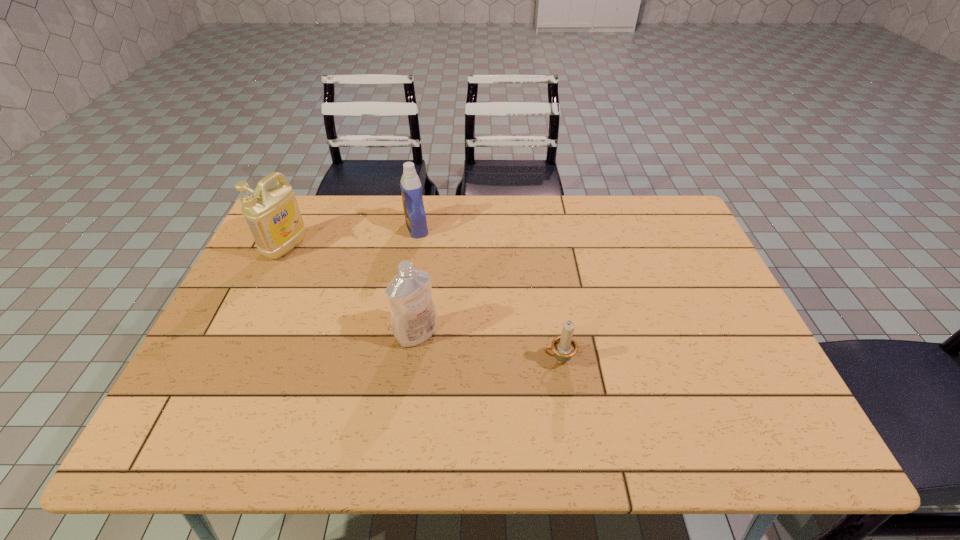
This screenshot has height=540, width=960. What are the coordinates of `object at the far left corner` in the screenshot? It's located at (272, 214).

Identify the location of vacant space at the far edge. The height and width of the screenshot is (540, 960). (351, 195).

Locate an element on the screen. vacant region at the near edge of the desktop is located at coordinates (250, 430).

At what (x,y) coordinates should I click in order to perform the action: click on vacant space at the right edge of the desktop. Please return your answer as a coordinate pair (x, y). This screenshot has width=960, height=540. Looking at the image, I should click on (723, 315).

Find the location of a particular element. This screenshot has height=540, width=960. free space at the far left corner of the desktop is located at coordinates (327, 199).

The height and width of the screenshot is (540, 960). In order to click on free region at the far right corner of the desktop in this screenshot , I will do `click(675, 220)`.

Find the location of `free space between the leftmost object and the nearest detergent`. free space between the leftmost object and the nearest detergent is located at coordinates pos(351,290).

Where is `free point between the leftmost detergent and the nearest detergent`? The height and width of the screenshot is (540, 960). free point between the leftmost detergent and the nearest detergent is located at coordinates (351, 290).

This screenshot has width=960, height=540. What are the coordinates of `unoccupied area between the leftmost object and the nearest detergent` in the screenshot? It's located at (351, 290).

The height and width of the screenshot is (540, 960). Identify the location of free space between the nearest detergent and the shortest object. (488, 347).